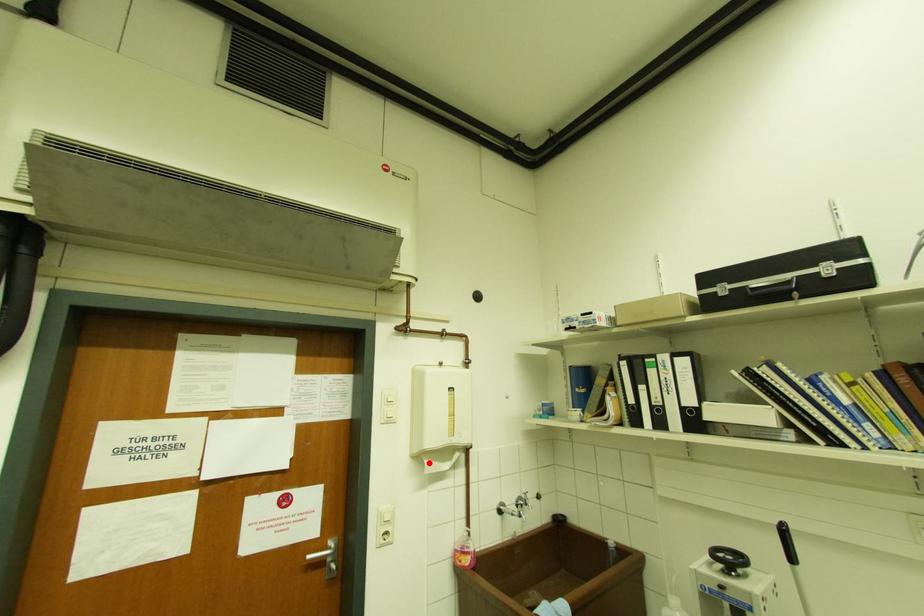
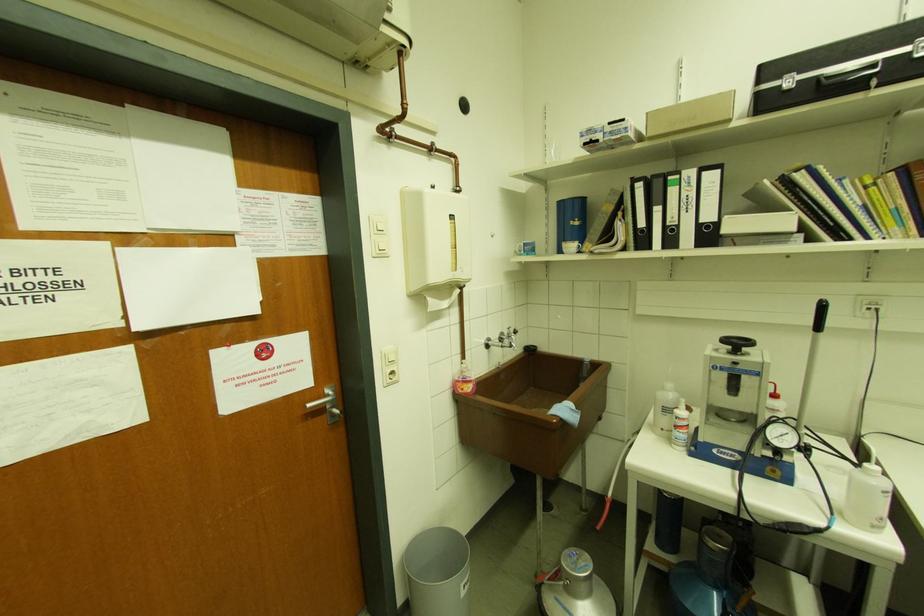
Find the pixel in the second image that matches the highlighted location in the first image.

(432, 300)